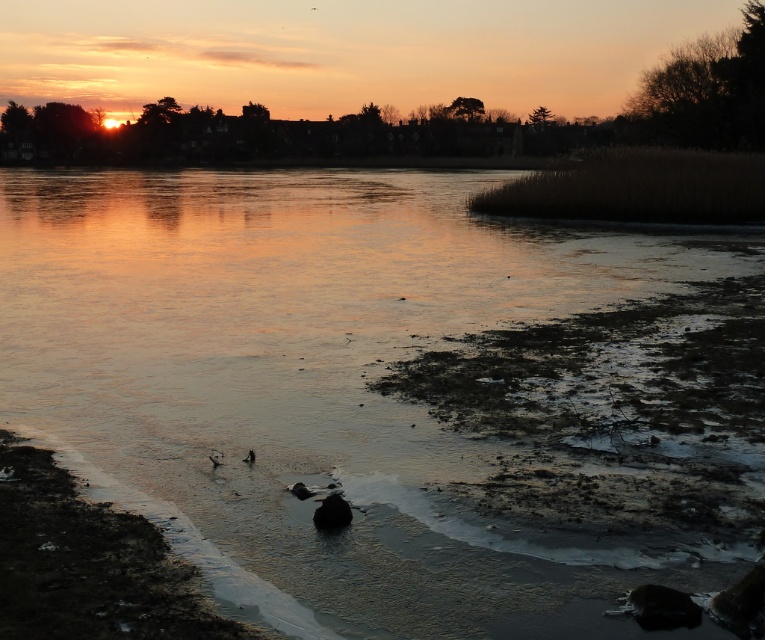
Question: Is translucent ice at center positioned behind brown fuzzy bird at lower center?

Choices:
 (A) no
 (B) yes

Answer: (A)

Question: Which point appears farthest from the camera in this image?

Choices:
 (A) (326, 512)
 (B) (246, 401)

Answer: (B)

Question: Is brown fuzzy bird at lower center above brown fuzzy duck at lower center?

Choices:
 (A) yes
 (B) no

Answer: (A)

Question: Is shiny black rock at center further to camera compared to brown fuzzy bird at lower center?

Choices:
 (A) yes
 (B) no

Answer: (B)

Question: Among these objects, which one is nearest to the camera?

Choices:
 (A) shiny black rock at center
 (B) brown fuzzy duck at lower center

Answer: (A)

Question: Which point is closer to the camera taking this photo?

Choices:
 (A) coord(340,499)
 (B) coord(217,465)
 (C) coord(243,460)
 (D) coord(389,580)

Answer: (D)